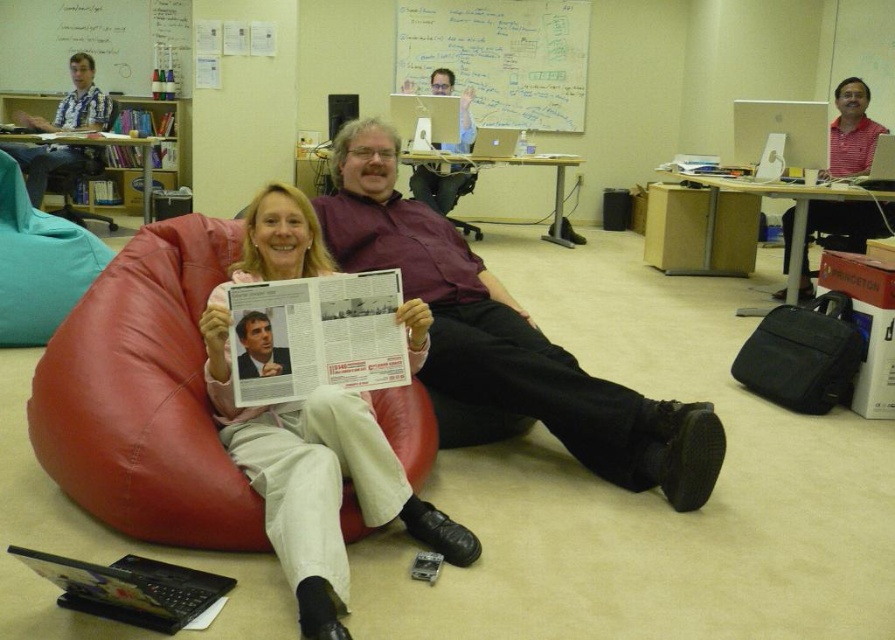
What are the coordinates of the red leather bean bag chair at center?

The red leather bean bag chair at center is located at coordinates point (x=145, y=396).

What is the spatial relationship between the red leather bean bag chair at center and the whiteboard at upper left?

The red leather bean bag chair at center is to the right of the whiteboard at upper left.